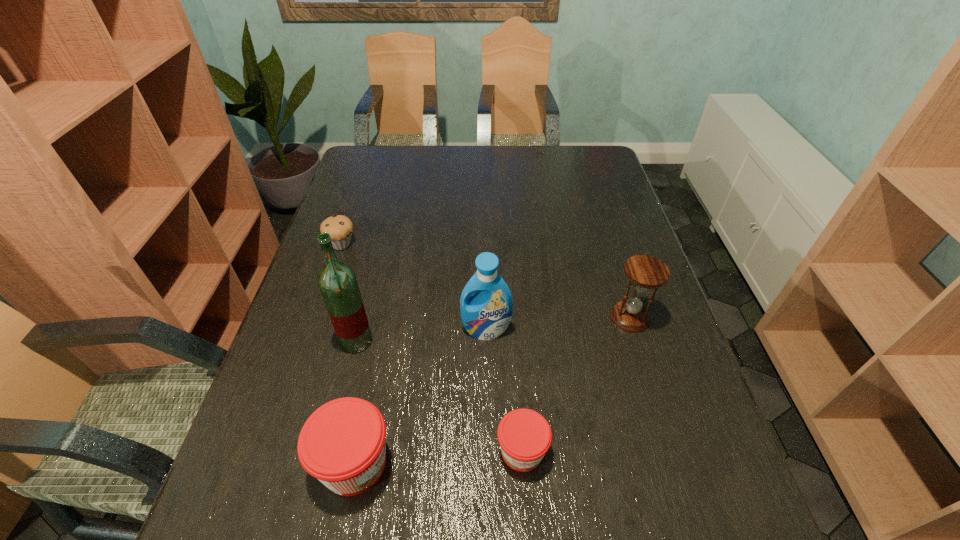
The image size is (960, 540). Find the location of `the fourth tallest object`. the fourth tallest object is located at coordinates (342, 444).

Locate an element on the screen. The height and width of the screenshot is (540, 960). the taller jam is located at coordinates (342, 444).

Locate an element on the screen. the shorter jam is located at coordinates (524, 435).

Identify the location of liquor. point(337,281).

At what (x,y) coordinates should I click in order to perform the action: click on the farthest object. Please return your answer as a coordinate pair (x, y). This screenshot has height=540, width=960. Looking at the image, I should click on (340, 227).

The image size is (960, 540). I want to click on the leftmost object, so click(x=340, y=227).

At what (x,y) coordinates should I click in order to perform the action: click on hourglass. Please return your answer as a coordinate pair (x, y). This screenshot has width=960, height=540. Looking at the image, I should click on (646, 272).

I want to click on the fourth shortest object, so tap(646, 272).

Find the location of a particular element. The width and height of the screenshot is (960, 540). detergent is located at coordinates (486, 315).

This screenshot has height=540, width=960. Find the location of `free space located on the label side of the fourth tallest object`. free space located on the label side of the fourth tallest object is located at coordinates (516, 463).